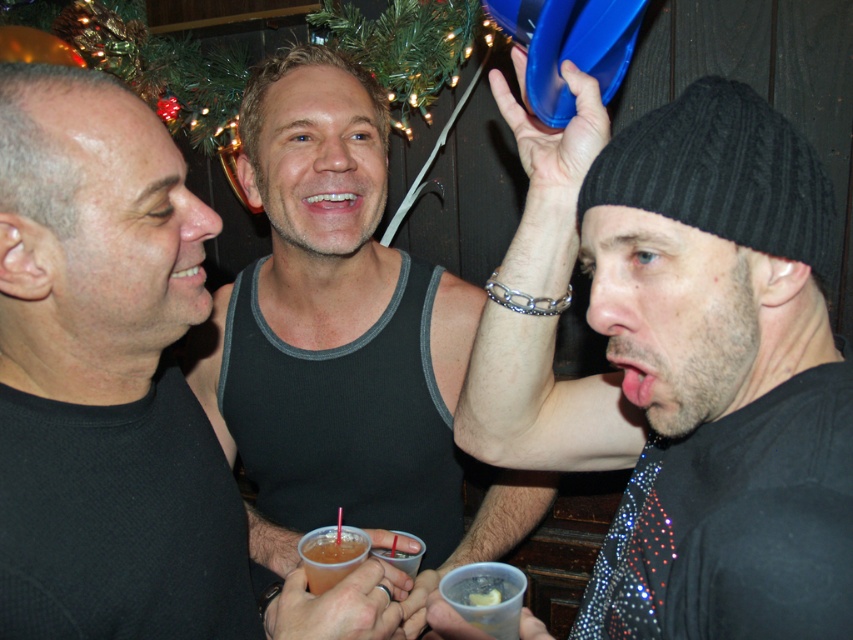
There are two men in the image. The first man is at point (238,324) and the second man is at point 0.490, 0.301. If you want to place a small table between them, what should be the minimum length of the table in meters?

The two men are 1.22 meters apart, so the minimum length of the table should be at least 1.22 meters to fit between them.

You are at a party and want to grab a drink from the table where the black sparkly shirt at right and the translucent plastic cup at center are located. Considering their sizes, which object would you need to move first to access the cup?

The black sparkly shirt at right has a greater height compared to the translucent plastic cup at center, so you would need to move the black sparkly shirt at right first to access the cup.